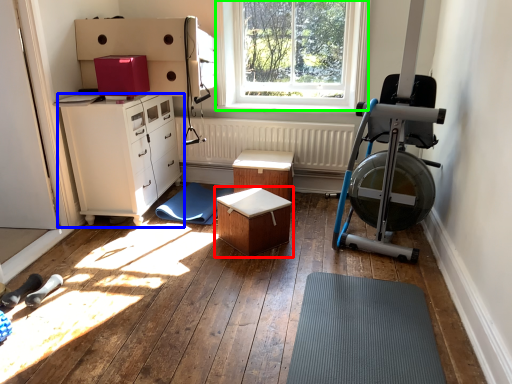
Question: Considering the real-world distances, which object is closest to table (highlighted by a red box)? chest of drawers (highlighted by a blue box) or window (highlighted by a green box).

Choices:
 (A) chest of drawers
 (B) window

Answer: (A)